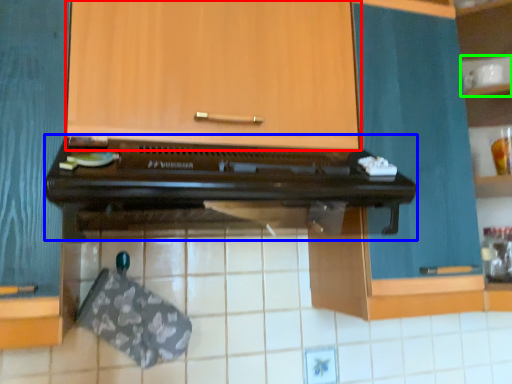
Question: Which object is positioned closest to cabinetry (highlighted by a red box)? Select from oven (highlighted by a blue box) and shelf (highlighted by a green box).

Choices:
 (A) oven
 (B) shelf

Answer: (A)